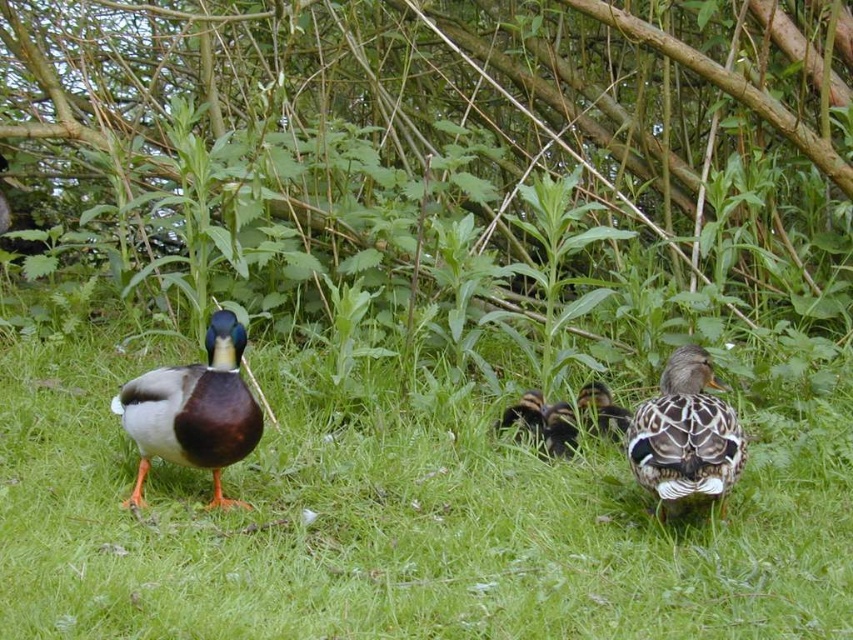
You are a photographer aiming to capture a clear photo of the speckled brown duckling at center. However, the speckled feathered duck at right is blocking your view. Can you adjust your position to avoid the obstruction?

The speckled feathered duck at right is in front of the speckled brown duckling at center, so moving your position behind the speckled feathered duck at right would allow you to see the speckled brown duckling at center without obstruction.